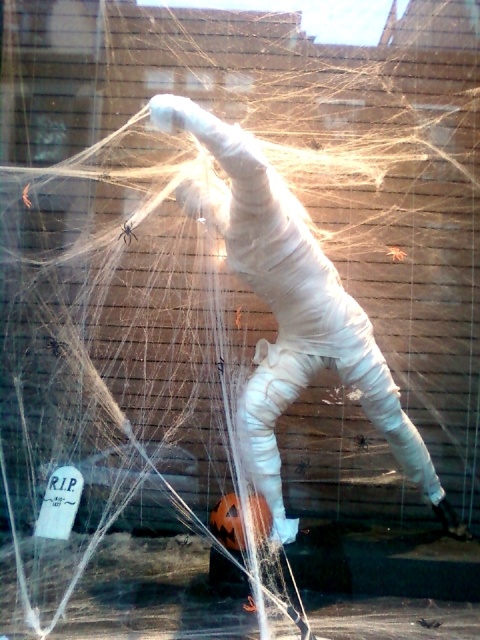
Who is positioned more to the right, white matte mummy at center or black fuzzy spider at center?

Positioned to the right is white matte mummy at center.

Between point (239, 260) and point (126, 236), which one is positioned behind?

Point (126, 236)

At what (x,y) coordinates should I click in order to perform the action: click on white matte mummy at center. Please return your answer as a coordinate pair (x, y). The width and height of the screenshot is (480, 640). Looking at the image, I should click on (290, 310).